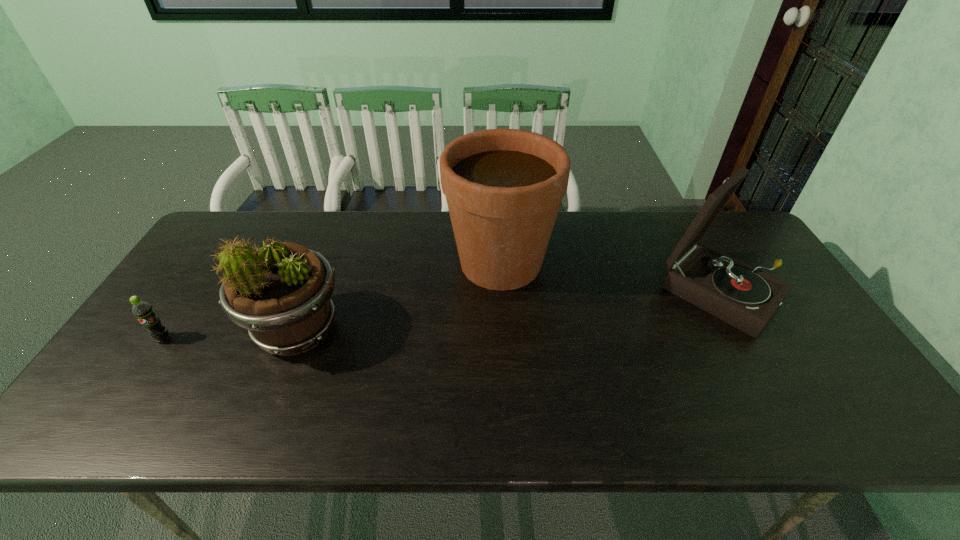
The width and height of the screenshot is (960, 540). In order to click on the right flowerpot in this screenshot , I will do pos(504,187).

Where is `the left flowerpot`? The height and width of the screenshot is (540, 960). the left flowerpot is located at coordinates (281, 292).

You are a GUI agent. You are given a task and a screenshot of the screen. Output one action in this format:
    pyautogui.click(x=<x>, y=<y>)
    Task: Click on the rightmost object
    This screenshot has height=540, width=960.
    Given the screenshot: What is the action you would take?
    pyautogui.click(x=729, y=289)

Locate an element on the screen. The height and width of the screenshot is (540, 960). the leftmost object is located at coordinates (143, 311).

Locate an element on the screen. The image size is (960, 540). the shortest object is located at coordinates (143, 311).

This screenshot has height=540, width=960. Identify the location of free spot located 0.300m on the left of the third object from left to right. (348, 263).

In order to click on vacant space situated 0.150m on the back of the left flowerpot in this screenshot , I will do `click(325, 259)`.

The image size is (960, 540). What are the coordinates of `free point located 0.250m on the left of the rightmost object` in the screenshot? It's located at (572, 293).

Where is `vacant point located on the front label of the shortest object`? The height and width of the screenshot is (540, 960). vacant point located on the front label of the shortest object is located at coordinates (103, 430).

Find the location of a particular element. flowerpot situated at the far edge is located at coordinates (504, 187).